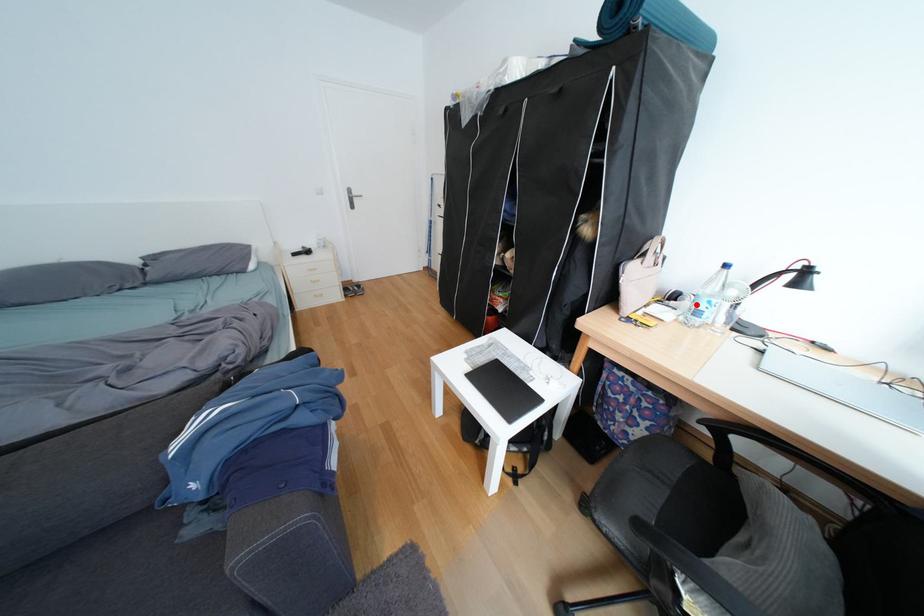
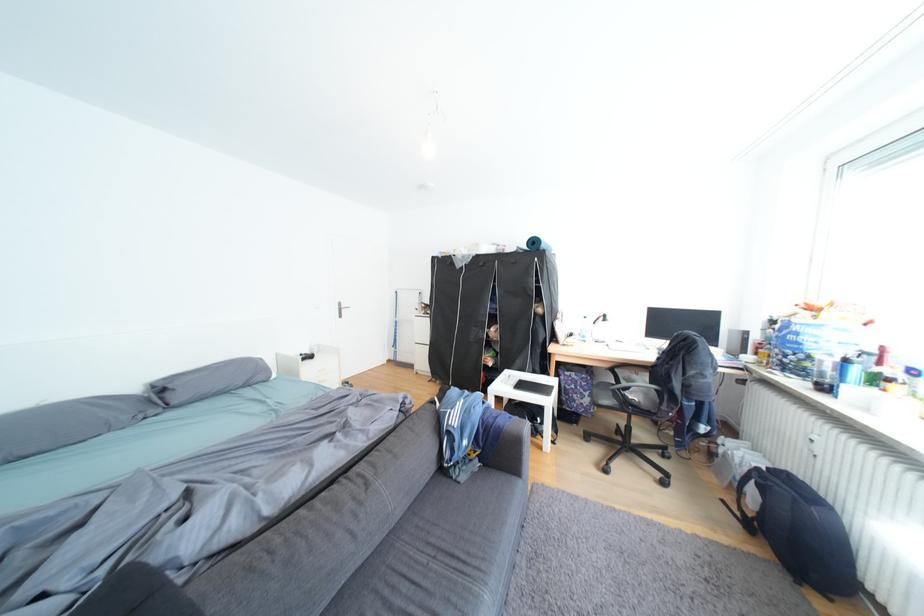
Question: I am providing you with two images of the same scene from different viewpoints. A red point is marked on the first image. Is the red point's position out of view in image 2?

Choices:
 (A) Yes
 (B) No

Answer: (B)